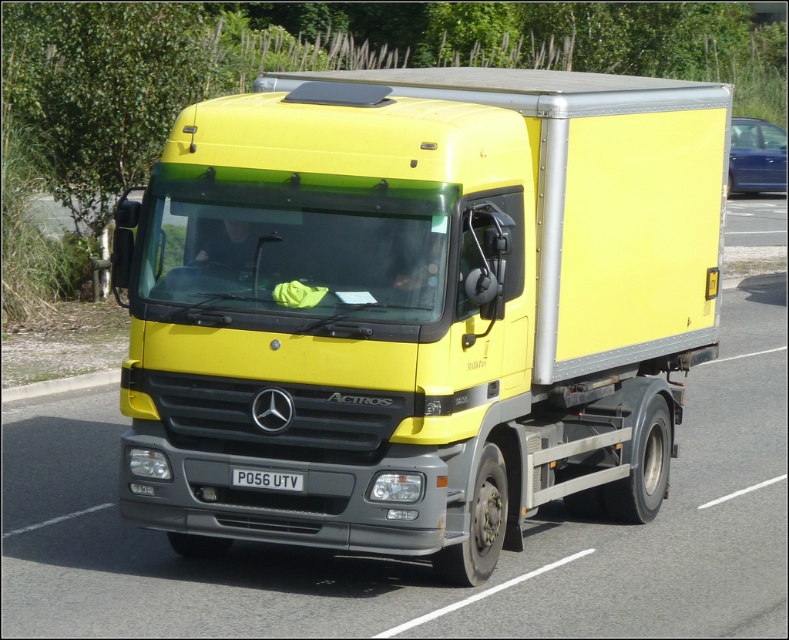
You are standing at the side of the road and see the Mercedes truck with its driver door open. There are two points marked on the road ahead of you. One is at coordinate point (350, 545) and the other at point (294, 486). Which point is closer to the front of the truck?

Point (350, 545) is in front of point (294, 486), so the point closer to the front of the truck is point (350, 545).

You are a traffic officer observing a vehicle. You see a yellow matte truck at center and a black plastic license plate at center. Which object is positioned to the left?

The black plastic license plate at center is positioned to the left of the yellow matte truck at center.